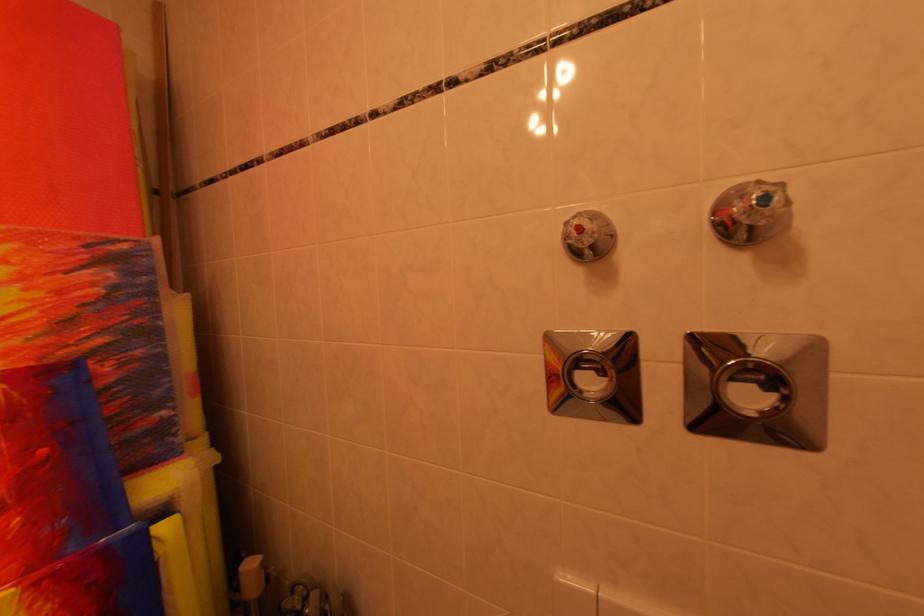
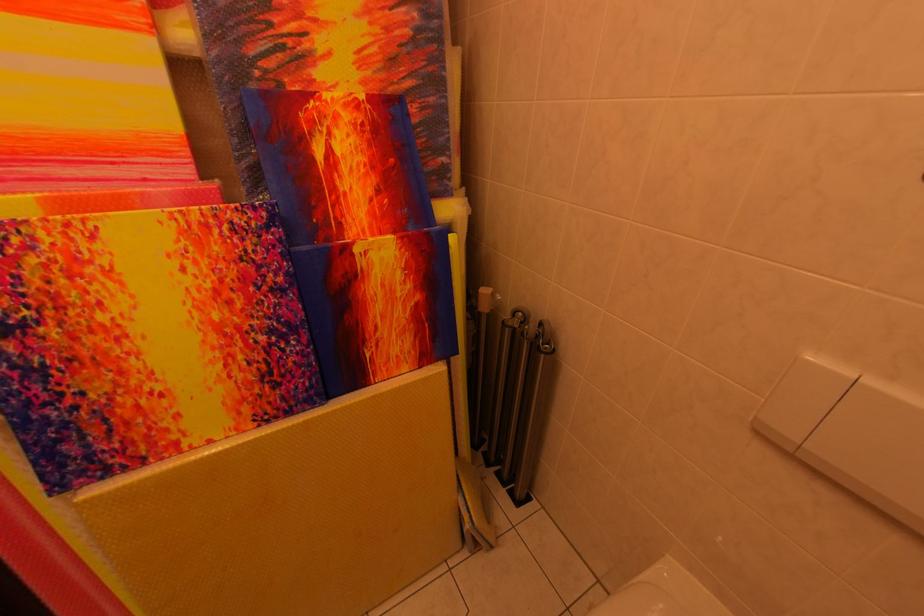
How did the camera likely rotate?

The camera's rotation is toward left-down.